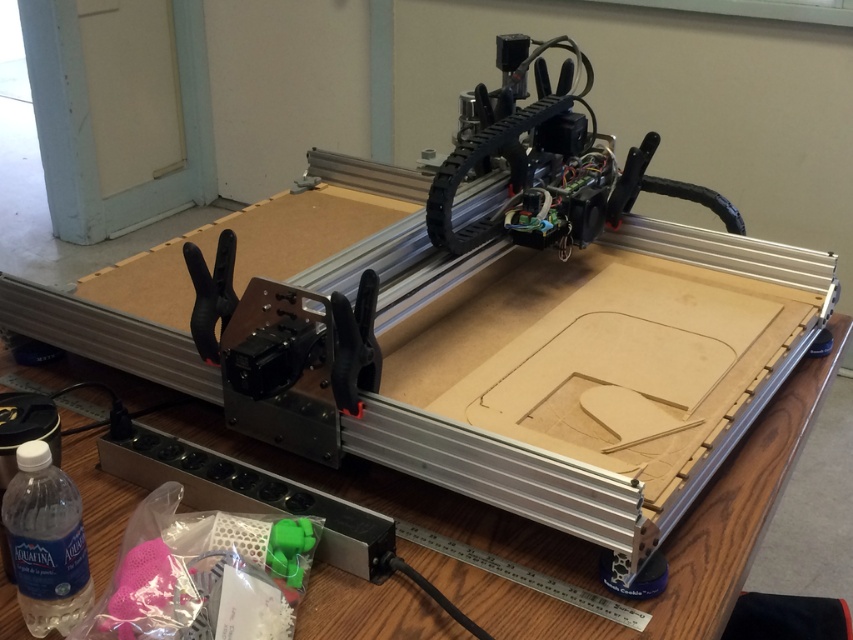
You are an engineer working in a workshop. You need to place a tool on the wooden table at center. To ensure you don not accidentally knock over the clear plastic bottle at lower left, which direction should you move towards from the bottle to reach the table?

The wooden table at center is to the right of the clear plastic bottle at lower left. So, to reach the table without knocking over the bottle, you should move towards the right direction from the bottle.

You are operating a CNC machine and need to move the cutting head from the point at coordinates point [746,426] to another point. The machine requires a minimum distance of 100 centimeters between points to ensure safety. Can you safely move the head to the other point without violating the safety requirement?

The distance between the two points is 99.37 centimeters, which is less than the required 100 centimeters for safety. Therefore, moving the cutting head to the other point would violate the safety requirement.

You are an engineer observing the CNC machine. You notice two points marked on the work surface at coordinates point (514, 470) and point (36, 534). From your perspective, which point is closer to the front of the machine?

Point (36, 534) is closer to the front of the machine because point (514, 470) is behind it.